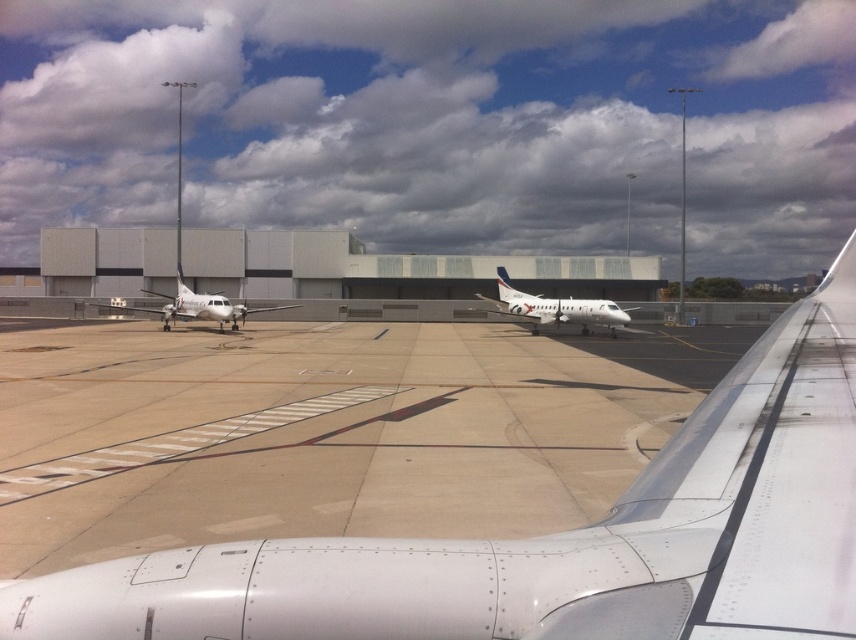
Question: Does silver metallic airplane at center have a lesser width compared to white glossy airplane window at center?

Choices:
 (A) yes
 (B) no

Answer: (B)

Question: Where is white metallic airplane at center located in relation to silver metallic airplane at center in the image?

Choices:
 (A) left
 (B) right

Answer: (A)

Question: Can you confirm if silver metallic airplane at center is positioned above white matte airplane at left?

Choices:
 (A) no
 (B) yes

Answer: (A)

Question: Which point is farther from the camera taking this photo?

Choices:
 (A) (220, 298)
 (B) (218, 294)
 (C) (742, 420)
 (D) (590, 300)

Answer: (B)

Question: Which object appears closest to the camera in this image?

Choices:
 (A) white metallic airplane at center
 (B) white matte airplane at left
 (C) white glossy airplane window at center
 (D) silver metallic airplane at center

Answer: (A)

Question: Which of these objects is positioned closest to the white metallic airplane at center?

Choices:
 (A) white glossy airplane window at center
 (B) white matte airplane at left
 (C) silver metallic airplane at center

Answer: (C)